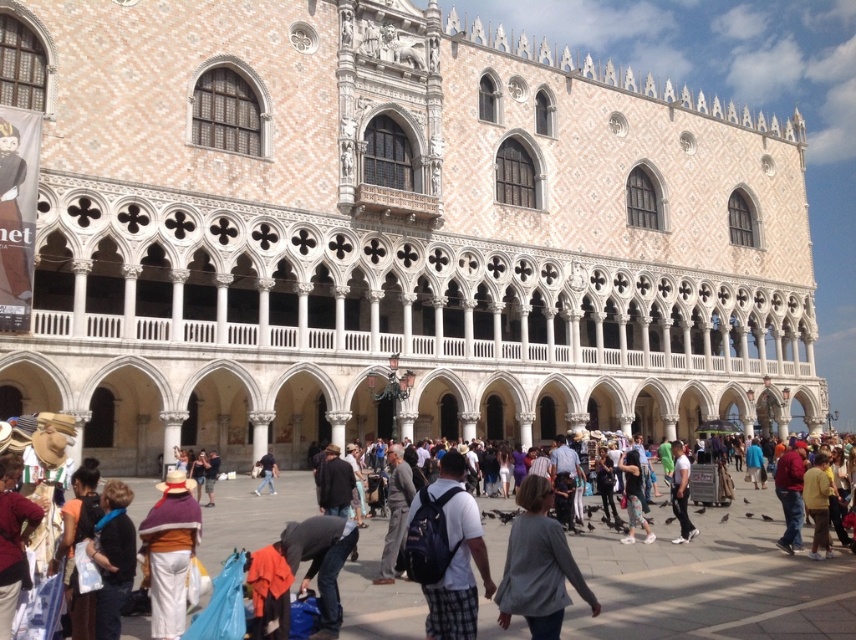
You are standing in the square and want to take a photo of the white stone building at center. The dark gray sweater at lower left is blocking your view. Can you estimate whether the building is wider than the sweater in the image?

The white stone building at center is wider than the dark gray sweater at lower left, so you can move slightly to the side to capture the entire building in your photo without the sweater blocking it.

You are standing in the square and see both the gray cotton sweater at center and the denim jacket at center. Which clothing item is closer to you?

The gray cotton sweater at center is closer to you because it is in front of the denim jacket at center.